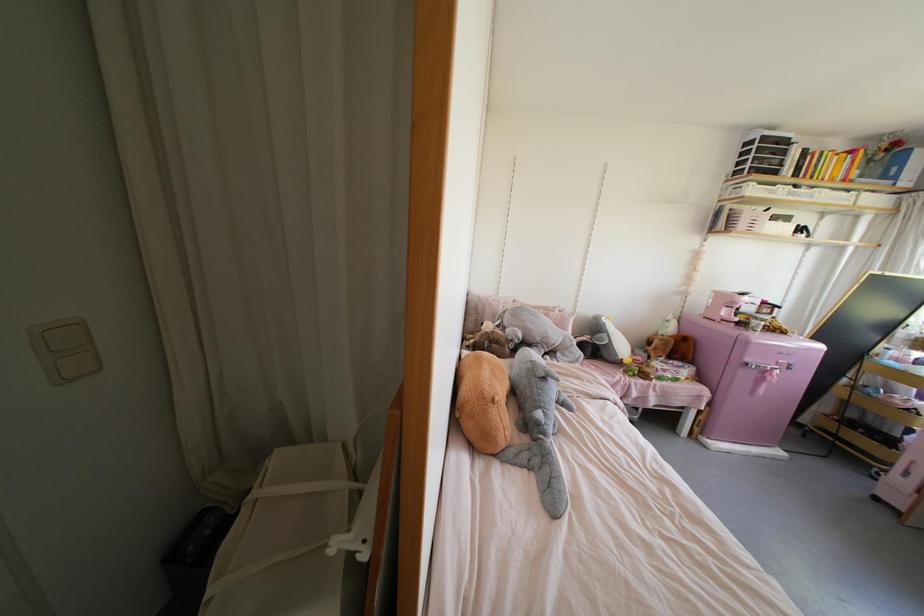
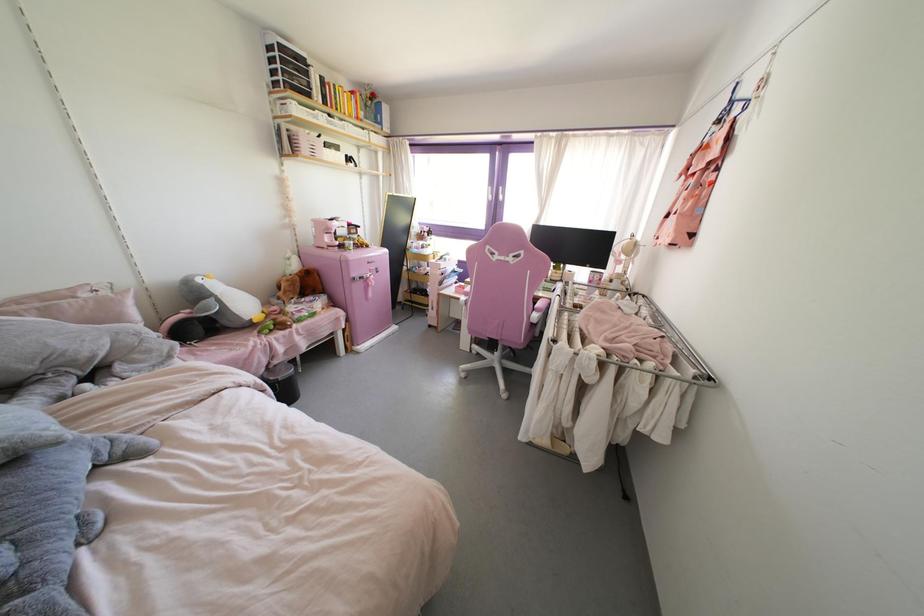
The point at (624, 361) is marked in the first image. Where is the corresponding point in the second image?

(254, 320)